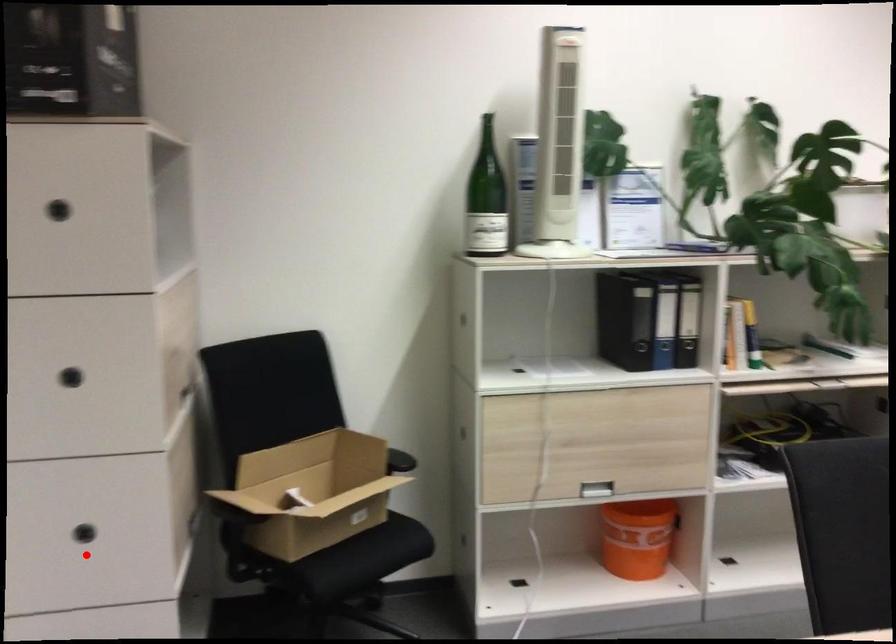
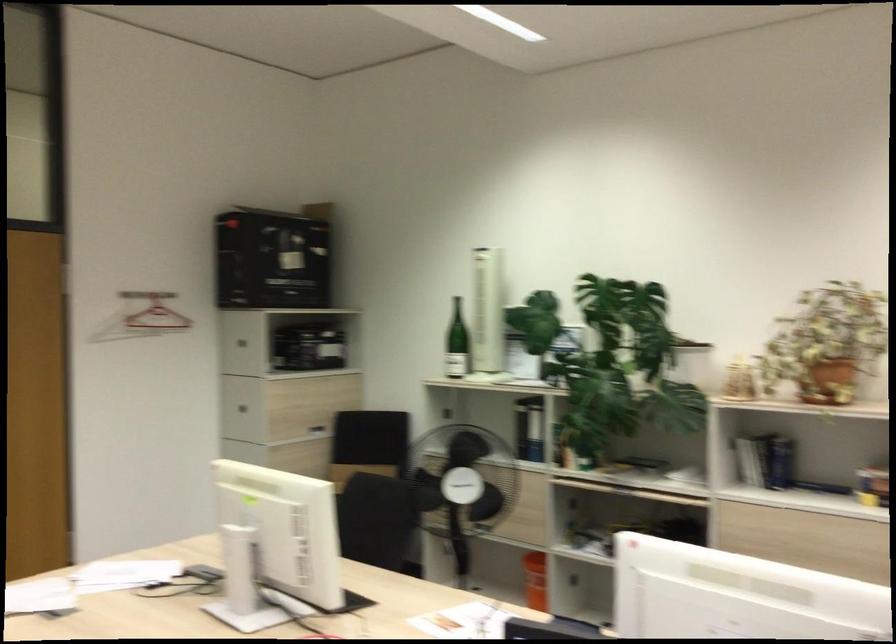
Question: I am providing you with two images of the same scene from different viewpoints. A red point is marked on the first image. Is the red point's position out of view in image 2?

Choices:
 (A) Yes
 (B) No

Answer: (A)